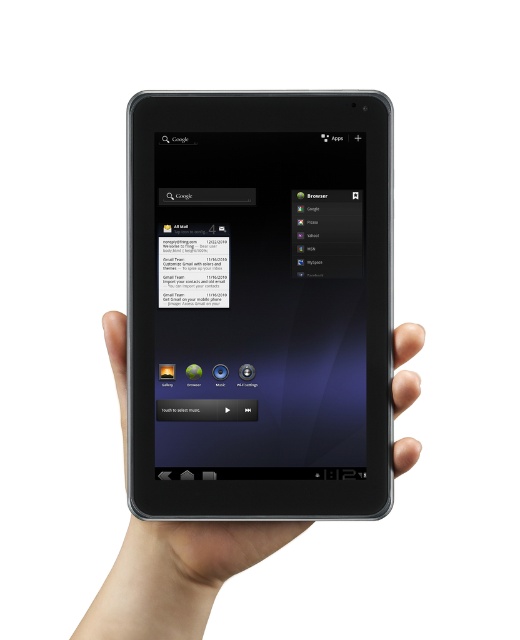
Can you confirm if black matte tablet at center is shorter than smooth skin hand at center?

Incorrect, black matte tablet at center's height does not fall short of smooth skin hand at center's.

Can you confirm if black matte tablet at center is positioned above smooth skin hand at center?

Yes.

Describe the element at coordinates (260, 305) in the screenshot. I see `black matte tablet at center` at that location.

This screenshot has height=640, width=520. I want to click on black matte tablet at center, so click(x=260, y=305).